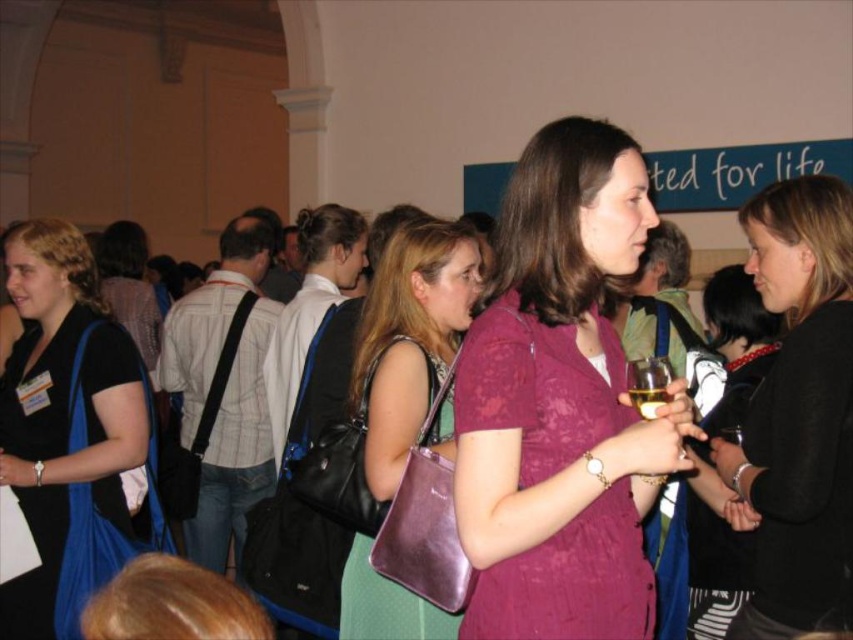
Who is shorter, black matte dress at center or translucent glass at center?

With less height is translucent glass at center.

Can you confirm if black matte dress at center is positioned to the right of translucent glass at center?

Indeed, black matte dress at center is positioned on the right side of translucent glass at center.

Identify the location of black matte dress at center. Image resolution: width=853 pixels, height=640 pixels. (798, 413).

Who is taller, shiny purple purse at center or black leather purse at center?

black leather purse at center is taller.

Where is `shiny purple purse at center`? shiny purple purse at center is located at coordinates (410, 337).

Between point (393, 240) and point (726, 520), which one is positioned behind?

Positioned behind is point (393, 240).

The image size is (853, 640). Find the location of `shiny purple purse at center`. shiny purple purse at center is located at coordinates coord(410,337).

Does black matte dress at center have a lesser width compared to black leather purse at center?

Yes, black matte dress at center is thinner than black leather purse at center.

Who is more distant from viewer, (756, 628) or (744, 301)?

Positioned behind is point (744, 301).

Identify the location of black matte dress at center. tap(798, 413).